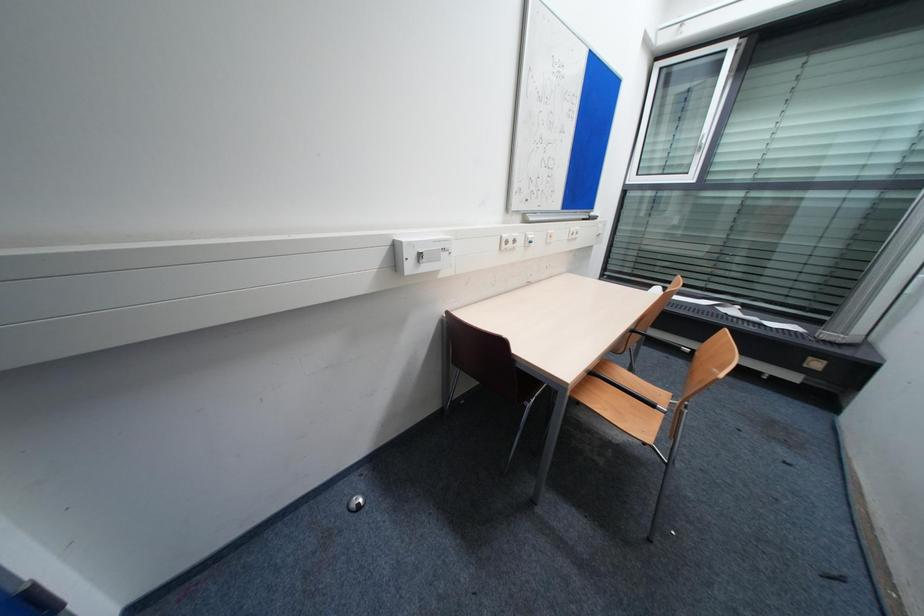
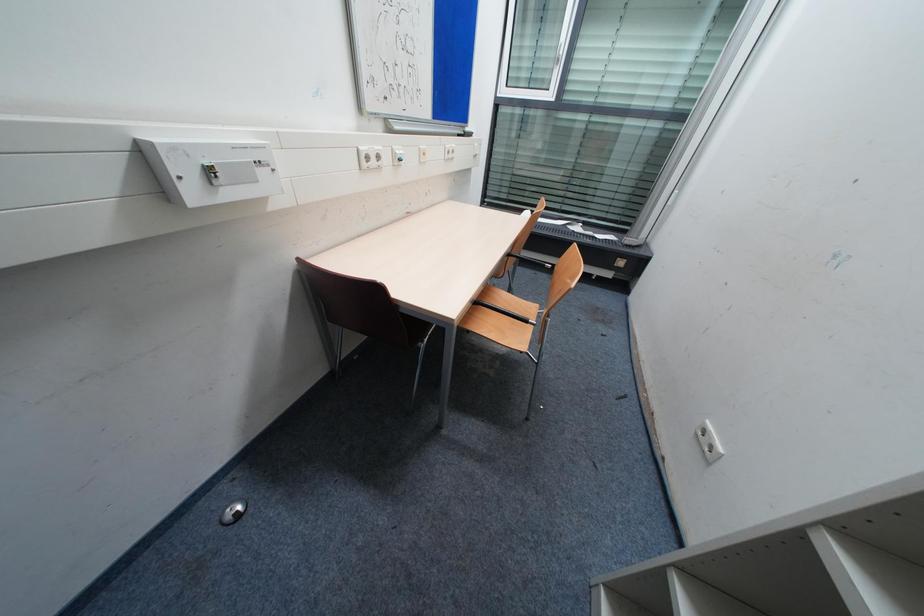
Which direction would the cameraman need to move to produce the second image?

The movement direction of the cameraman is right, forward.